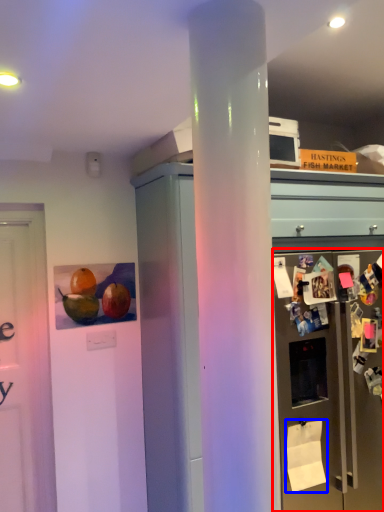
Question: Which point is closer to the camera, refrigerator (highlighted by a red box) or toilet paper (highlighted by a blue box)?

Choices:
 (A) refrigerator
 (B) toilet paper

Answer: (A)